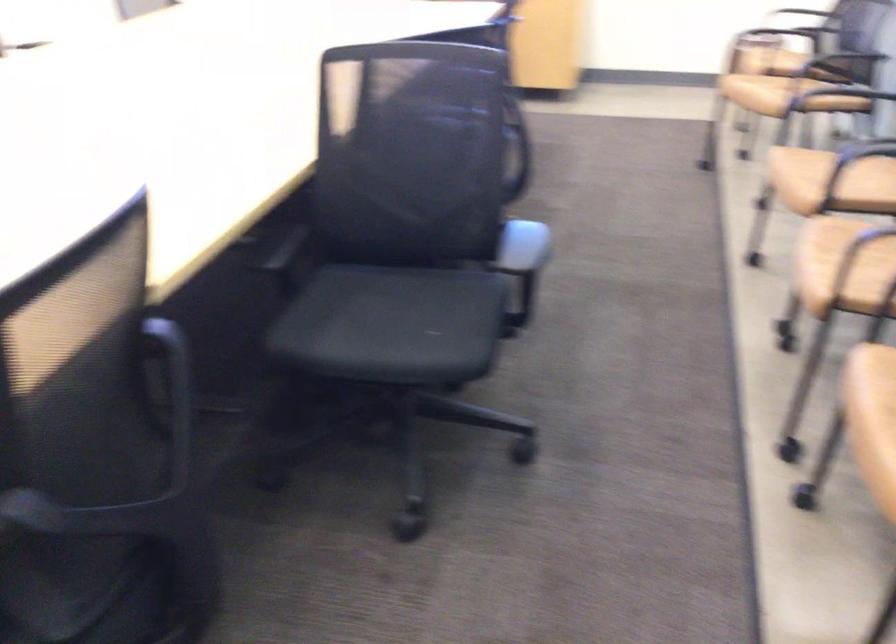
This screenshot has width=896, height=644. In order to click on black chair sitting surface in this screenshot , I will do `click(392, 301)`.